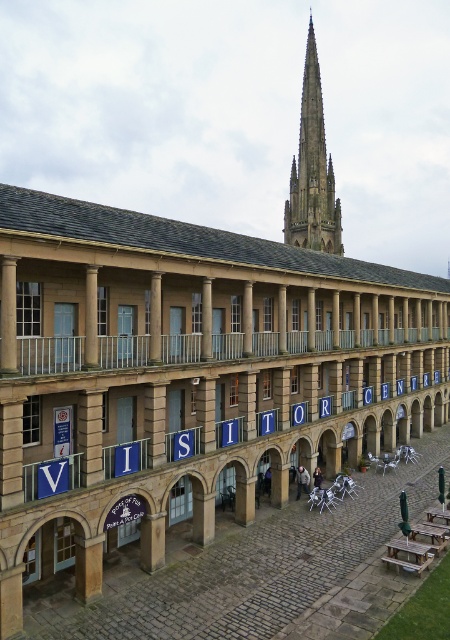
You are a visitor standing in the courtyard of the historic building. You see the dark gray stone spire at upper center and the wooden picnic table at lower right. Which object is located above the other?

The dark gray stone spire at upper center is positioned over the wooden picnic table at lower right, meaning it is above it.

You are standing in the courtyard of the historic building and notice a dark gray stone spire at upper center. Where exactly is this spire positioned relative to the building?

The dark gray stone spire at upper center is located at coordinates point (313, 172) relative to the building.